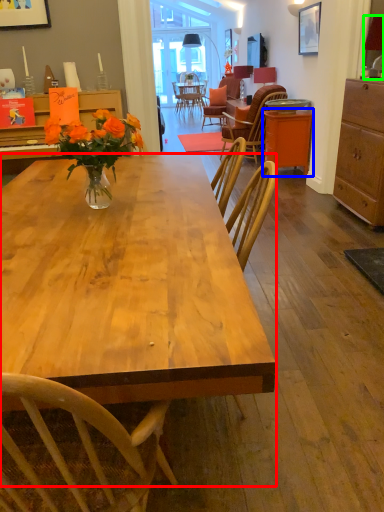
Question: Estimate the real-world distances between objects in this image. Which object is closer to desk (highlighted by a red box), table (highlighted by a blue box) or lamp (highlighted by a green box)?

Choices:
 (A) table
 (B) lamp

Answer: (B)